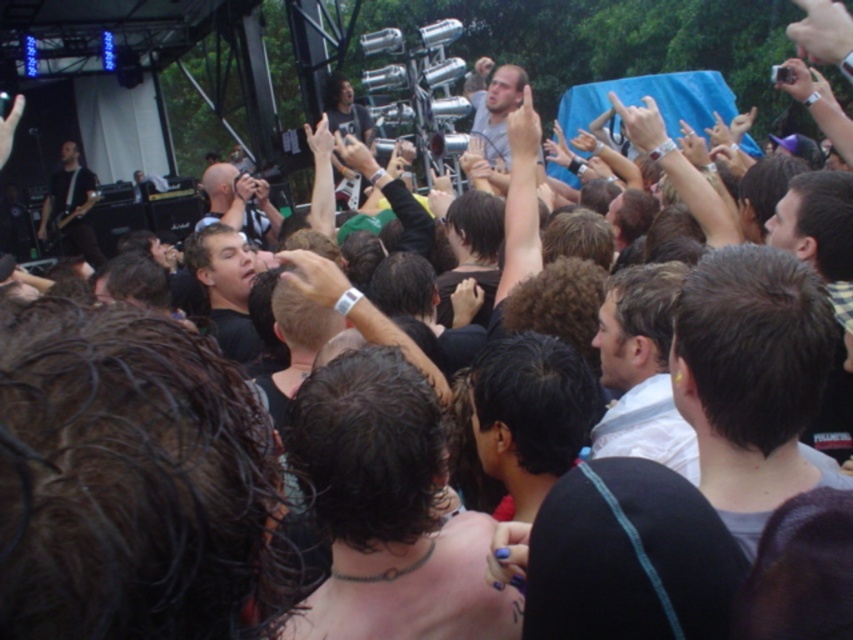
Can you confirm if dark brown hair at center is taller than white striped shirt at center?

Yes.

Is point (463, 604) closer to camera compared to point (640, 301)?

Yes, point (463, 604) is in front of point (640, 301).

The image size is (853, 640). I want to click on dark brown hair at center, so click(x=387, y=509).

Between point (746, 474) and point (80, 236), which one is positioned in front?

Positioned in front is point (746, 474).

Does short brown hair at center lie behind black leather guitar at left?

No, short brown hair at center is closer to the viewer.

Where is `short brown hair at center`? This screenshot has width=853, height=640. short brown hair at center is located at coordinates (751, 378).

Is point (229, 308) behind point (67, 168)?

No, it is in front of (67, 168).

Does point (206, 292) lie in front of point (49, 212)?

Yes, it is in front of point (49, 212).

The image size is (853, 640). Find the location of `black shirt at center`. black shirt at center is located at coordinates (225, 285).